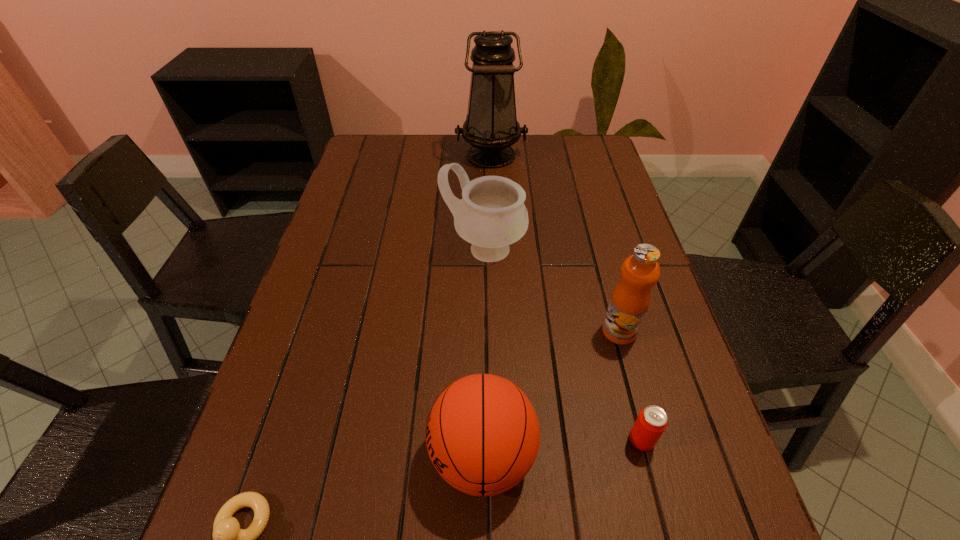
Identify the location of the farthest object. The height and width of the screenshot is (540, 960). (491, 127).

At what (x,y) coordinates should I click in order to perform the action: click on oil lamp. Please return your answer as a coordinate pair (x, y). Image resolution: width=960 pixels, height=540 pixels. Looking at the image, I should click on (491, 127).

You are a GUI agent. You are given a task and a screenshot of the screen. Output one action in this format:
    pyautogui.click(x=<x>, y=<y>)
    Task: Click on the third farthest object
    This screenshot has width=960, height=540.
    Given the screenshot: What is the action you would take?
    pyautogui.click(x=631, y=297)

This screenshot has height=540, width=960. In order to click on the fifth nearest object in this screenshot , I will do `click(491, 215)`.

This screenshot has width=960, height=540. Identify the location of basketball. (482, 434).

Identify the location of the second shortest object. The image size is (960, 540). (650, 424).

Locate an element on the screen. This screenshot has width=960, height=540. vacant space located 0.180m on the left of the farthest object is located at coordinates pyautogui.click(x=404, y=155).

In order to click on free region located on the back of the fruit juice in this screenshot , I will do `click(599, 256)`.

I want to click on vacant position located on the back of the pottery, so click(x=483, y=184).

At what (x,y) coordinates should I click in order to perform the action: click on free space located on the side with logo of the fourth tallest object. Please return your answer as a coordinate pair (x, y). This screenshot has width=960, height=540. Looking at the image, I should click on (371, 456).